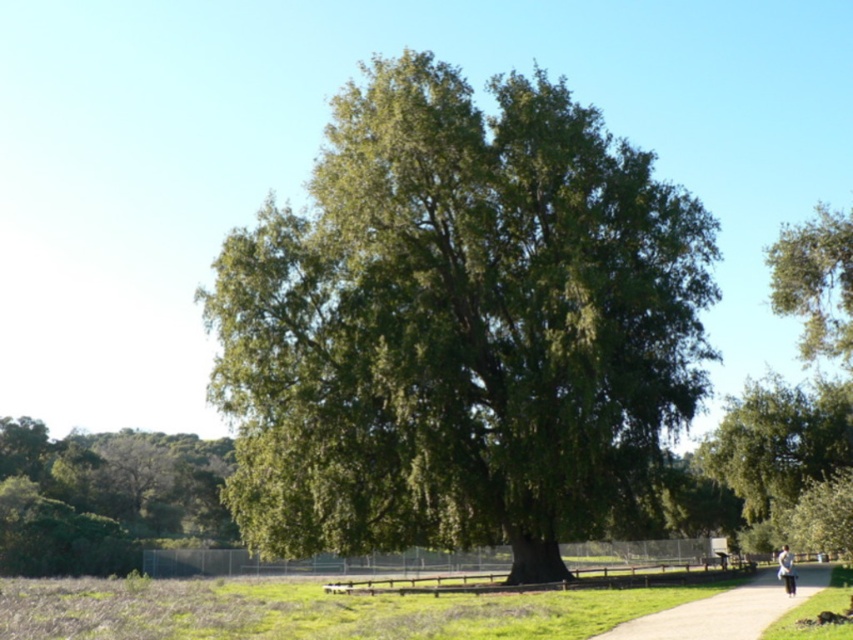
Question: Which object is farther from the camera taking this photo?

Choices:
 (A) green leafy tree at center
 (B) smooth concrete path at center
 (C) green leafy tree at lower left

Answer: (C)

Question: Does green leafy tree at center appear under light blue jeans at lower right?

Choices:
 (A) no
 (B) yes

Answer: (A)

Question: Which point is closer to the camera?

Choices:
 (A) (782, 556)
 (B) (364, 136)
 (C) (0, 528)
 (D) (798, 593)

Answer: (A)

Question: Does green leafy tree at lower left appear on the right side of light blue jeans at lower right?

Choices:
 (A) yes
 (B) no

Answer: (B)

Question: Which point is farther from the camera taking this photo?

Choices:
 (A) (767, 608)
 (B) (474, 403)

Answer: (B)

Question: Can you confirm if green leafy tree at lower left is smaller than light blue jeans at lower right?

Choices:
 (A) yes
 (B) no

Answer: (B)